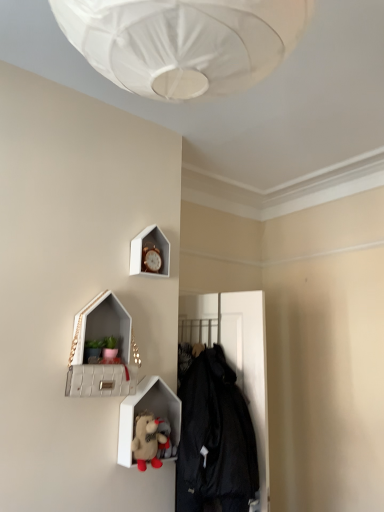
Question: Does gold metallic clock at upper center have a larger size compared to fluffy plush toy at lower center?

Choices:
 (A) yes
 (B) no

Answer: (B)

Question: Can you confirm if gold metallic clock at upper center is smaller than fluffy plush toy at lower center?

Choices:
 (A) yes
 (B) no

Answer: (A)

Question: Can you confirm if gold metallic clock at upper center is taller than fluffy plush toy at lower center?

Choices:
 (A) yes
 (B) no

Answer: (A)

Question: Is gold metallic clock at upper center facing towards fluffy plush toy at lower center?

Choices:
 (A) no
 (B) yes

Answer: (A)

Question: Considering the relative sizes of gold metallic clock at upper center and fluffy plush toy at lower center in the image provided, is gold metallic clock at upper center wider than fluffy plush toy at lower center?

Choices:
 (A) yes
 (B) no

Answer: (B)

Question: From the image's perspective, is white quilted leather medicine cabinet at upper left positioned above or below gold metallic clock at upper center?

Choices:
 (A) above
 (B) below

Answer: (B)

Question: Does point (119, 367) appear closer or farther from the camera than point (142, 263)?

Choices:
 (A) closer
 (B) farther

Answer: (A)

Question: Is white quilted leather medicine cabinet at upper left bigger or smaller than gold metallic clock at upper center?

Choices:
 (A) big
 (B) small

Answer: (A)

Question: Is white quilted leather medicine cabinet at upper left inside the boundaries of gold metallic clock at upper center, or outside?

Choices:
 (A) inside
 (B) outside

Answer: (B)

Question: Is white textured shelf at lower center taller or shorter than white quilted leather medicine cabinet at upper left?

Choices:
 (A) short
 (B) tall

Answer: (A)

Question: In terms of size, does white textured shelf at lower center appear bigger or smaller than white quilted leather medicine cabinet at upper left?

Choices:
 (A) small
 (B) big

Answer: (A)

Question: Considering the positions of point (142, 404) and point (81, 373), is point (142, 404) closer or farther from the camera than point (81, 373)?

Choices:
 (A) farther
 (B) closer

Answer: (A)

Question: Is white textured shelf at lower center inside the boundaries of white quilted leather medicine cabinet at upper left, or outside?

Choices:
 (A) outside
 (B) inside

Answer: (A)

Question: From a real-world perspective, is fluffy plush toy at lower center above or below white quilted leather medicine cabinet at upper left?

Choices:
 (A) below
 (B) above

Answer: (A)

Question: In the image, is fluffy plush toy at lower center positioned in front of or behind white quilted leather medicine cabinet at upper left?

Choices:
 (A) behind
 (B) front

Answer: (A)